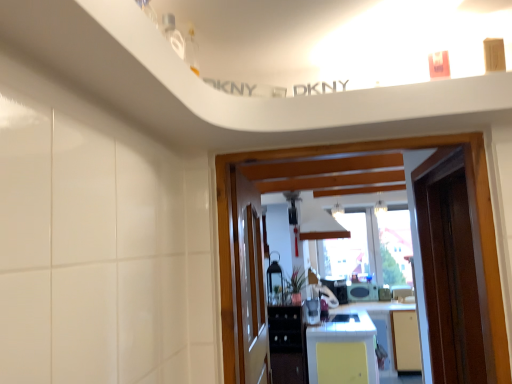
Question: Considering the relative positions of yellow matte countertop at center and black glossy cabinet at center in the image provided, is yellow matte countertop at center to the left of black glossy cabinet at center from the viewer's perspective?

Choices:
 (A) yes
 (B) no

Answer: (B)

Question: Considering the relative positions of yellow matte countertop at center and black glossy cabinet at center in the image provided, is yellow matte countertop at center in front of black glossy cabinet at center?

Choices:
 (A) yes
 (B) no

Answer: (A)

Question: Is black glossy cabinet at center surrounded by yellow matte countertop at center?

Choices:
 (A) yes
 (B) no

Answer: (B)

Question: From the image's perspective, is yellow matte countertop at center under black glossy cabinet at center?

Choices:
 (A) yes
 (B) no

Answer: (A)

Question: Does yellow matte countertop at center have a lesser height compared to black glossy cabinet at center?

Choices:
 (A) yes
 (B) no

Answer: (B)

Question: Would you say yellow matte countertop at center is outside black glossy cabinet at center?

Choices:
 (A) no
 (B) yes

Answer: (B)

Question: Is wooden door at center, the 1th door viewed from the left, smaller than yellow matte countertop at center?

Choices:
 (A) yes
 (B) no

Answer: (A)

Question: From a real-world perspective, is wooden door at center, the second door positioned from the right, on top of yellow matte countertop at center?

Choices:
 (A) yes
 (B) no

Answer: (A)

Question: Does wooden door at center, the 1th door viewed from the left, have a lesser width compared to yellow matte countertop at center?

Choices:
 (A) no
 (B) yes

Answer: (B)

Question: Does wooden door at center, the second door positioned from the right, lie behind yellow matte countertop at center?

Choices:
 (A) no
 (B) yes

Answer: (A)

Question: Are wooden door at center, the 1th door viewed from the left, and yellow matte countertop at center making contact?

Choices:
 (A) no
 (B) yes

Answer: (A)

Question: Is wooden door at center, the 1th door viewed from the left, at the left side of yellow matte countertop at center?

Choices:
 (A) yes
 (B) no

Answer: (A)

Question: Is yellow matte countertop at center facing away from metallic silver toaster at center, acting as the 3th appliance starting from the right?

Choices:
 (A) no
 (B) yes

Answer: (A)